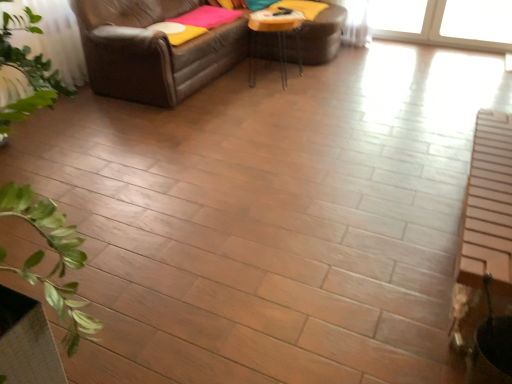
Find the location of a particular element. leather couch at upper left is located at coordinates (153, 50).

Describe the element at coordinates (153, 50) in the screenshot. Image resolution: width=512 pixels, height=384 pixels. I see `leather couch at upper left` at that location.

Where is `leather couch at upper left`? This screenshot has height=384, width=512. leather couch at upper left is located at coordinates (153, 50).